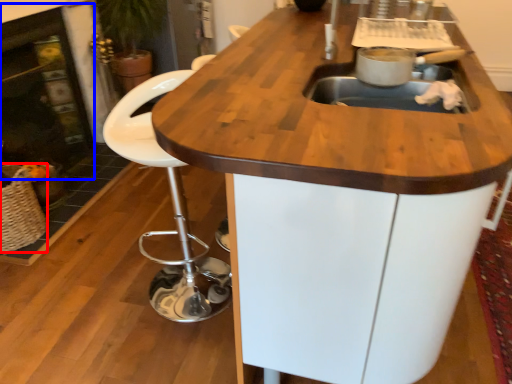
Question: Among these objects, which one is farthest to the camera, basket (highlighted by a red box) or fireplace (highlighted by a blue box)?

Choices:
 (A) basket
 (B) fireplace

Answer: (B)